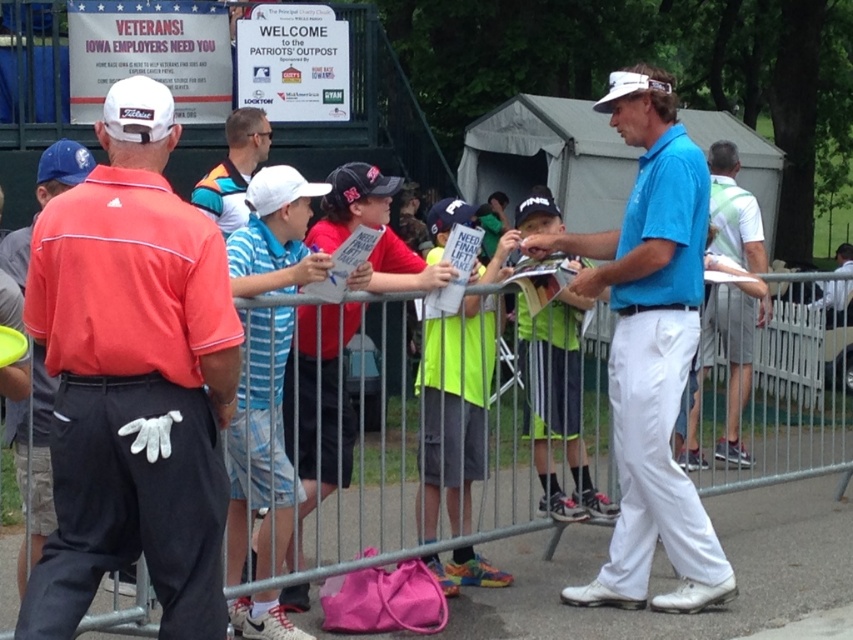
Question: Which point is closer to the camera taking this photo?

Choices:
 (A) (695, 252)
 (B) (230, 150)
 (C) (25, 465)
 (D) (749, 316)

Answer: (C)

Question: Which point is farther from the camera taking this photo?

Choices:
 (A) (33, 496)
 (B) (657, 83)
 (C) (178, 276)
 (D) (448, 365)

Answer: (D)

Question: Can you confirm if blue smooth shirt at center is wider than blue shirt at center?

Choices:
 (A) yes
 (B) no

Answer: (A)

Question: Can you confirm if blue smooth shirt at center is positioned to the right of orange shirt at center?

Choices:
 (A) no
 (B) yes

Answer: (B)

Question: Which of these objects is positioned farthest from the blue shirt at center?

Choices:
 (A) matte white cap at left
 (B) matte orange polo shirt at left
 (C) orange shirt at center
 (D) blue smooth shirt at center

Answer: (A)

Question: Does metal at center lie behind orange shirt at center?

Choices:
 (A) yes
 (B) no

Answer: (B)